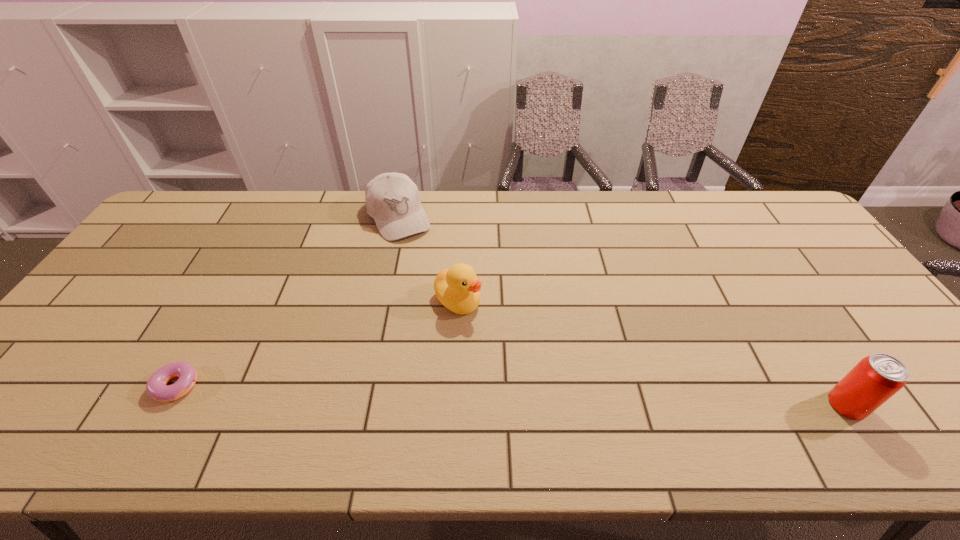
Find the location of `doughnut`. doughnut is located at coordinates (156, 387).

I want to click on the leftmost object, so click(x=156, y=387).

Identify the location of the rightmost object. (875, 379).

Find the location of a particular element. duck is located at coordinates (457, 288).

Identify the location of the third nearest object. (457, 288).

Where is `the farthest object`? the farthest object is located at coordinates (x=392, y=199).

Identify the location of baseball cap. (392, 199).

At what (x,y) coordinates should I click in order to perform the action: click on vacant area situated on the right of the shortest object. Please return your answer as a coordinate pair (x, y). The height and width of the screenshot is (540, 960). Looking at the image, I should click on (272, 381).

I want to click on vacant region located on the left of the rightmost object, so click(737, 405).

In order to click on vacant position located at the beak of the third nearest object in this screenshot , I will do `click(545, 377)`.